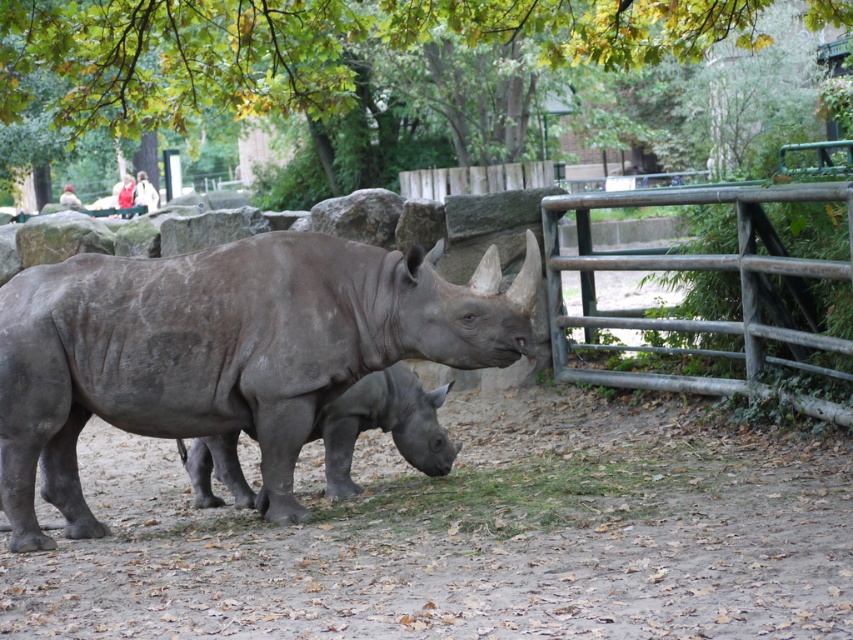
Consider the image. You are a zookeeper standing at the entrance of the enclosure. You need to place a new white cotton jacket at upper left on a bench near the fence. However, you must ensure it doesn t block the view of the gray matte rhino at center. Is the current placement of the jacket possible without blocking the rhino?

The gray matte rhino at center is closer to the viewer than the white cotton jacket at upper left. Since the rhino is in front, placing the jacket behind it won t block the view. Therefore, the jacket can be placed at upper left without obstructing the rhino.

You are standing at the zoo enclosure and want to take a photo of the rhinoceroses. The zoo requires visitors to stay at least 25 feet away from the animals for safety. Is the point at coordinates point (337, 429) safe to stand on?

The distance of point (337, 429) from camera is 26.66 feet, which is more than the required 25 feet. Therefore, it is safe to stand at point (337, 429).